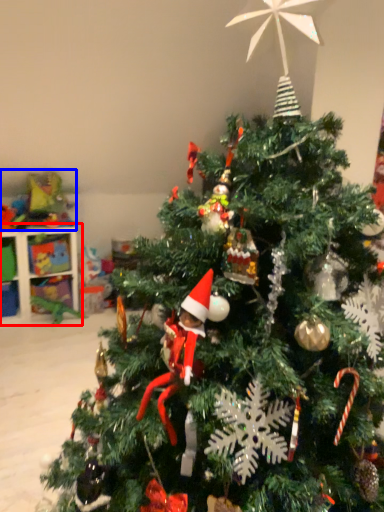
Question: Which object is closer to the camera taking this photo, shelf (highlighted by a red box) or toy (highlighted by a blue box)?

Choices:
 (A) shelf
 (B) toy

Answer: (A)